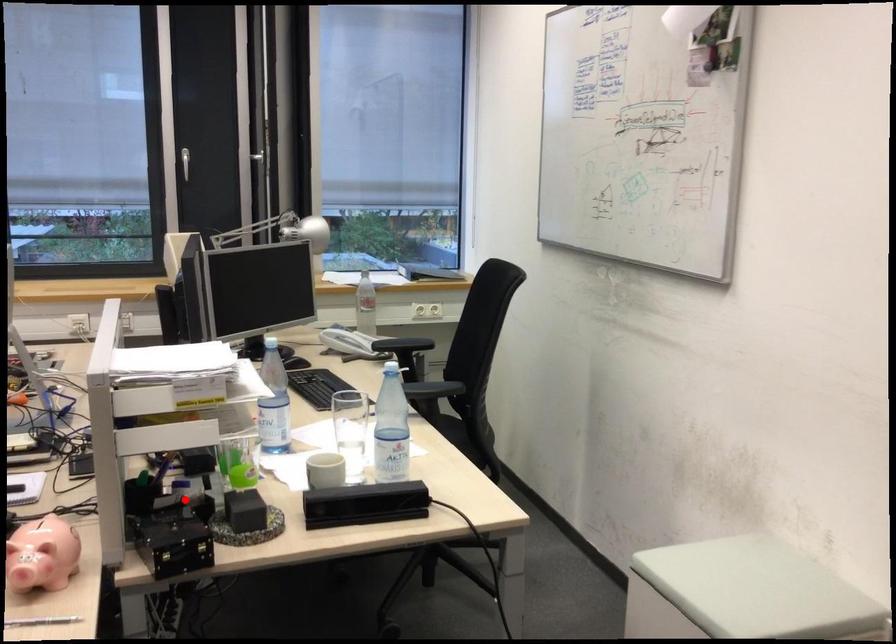
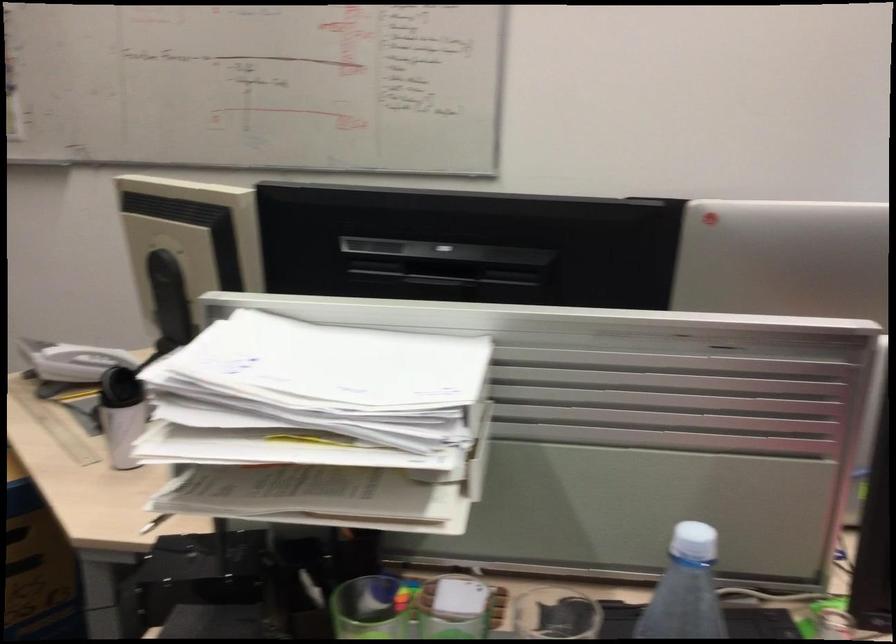
In the second image, find the point that corresponds to the highlighted location in the first image.

(367, 609)